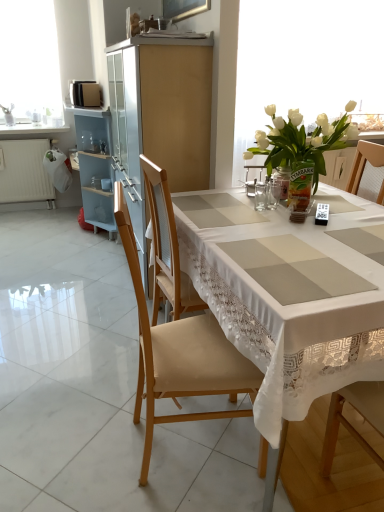
The height and width of the screenshot is (512, 384). In order to click on free location in front of white matte radiator at left in this screenshot , I will do `click(42, 220)`.